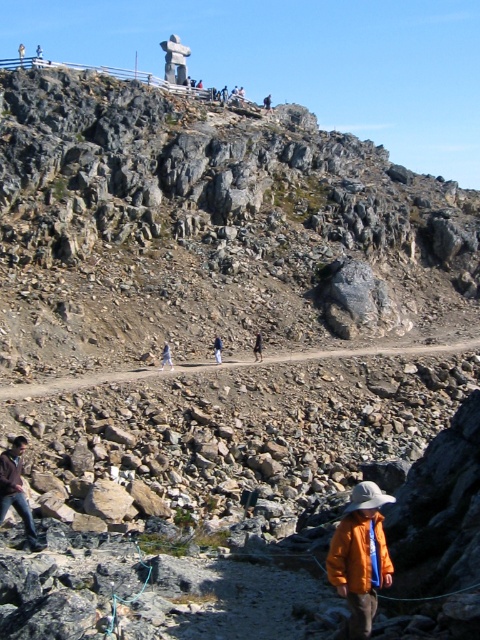
Can you confirm if blue fabric pants at center is thinner than dark blue jeans at center?

Yes.

Identify the location of blue fabric pants at center. (166, 356).

This screenshot has width=480, height=640. What are the coordinates of `blue fabric pants at center` in the screenshot? It's located at (166, 356).

Who is more forward, (2, 499) or (169, 358)?

Point (2, 499)

Locate an element on the screen. Image resolution: width=480 pixels, height=640 pixels. brown leather jacket at lower left is located at coordinates (15, 490).

Who is more forward, (335, 579) or (216, 353)?

Point (335, 579)

Does orange matte jacket at lower right have a greater width compared to light blue denim jacket at center?

Yes.

Measure the distance between point (358, 516) and camera.

Point (358, 516) is 21.67 meters away from camera.

Image resolution: width=480 pixels, height=640 pixels. What are the coordinates of `orange matte jacket at lower right` in the screenshot? It's located at (360, 556).